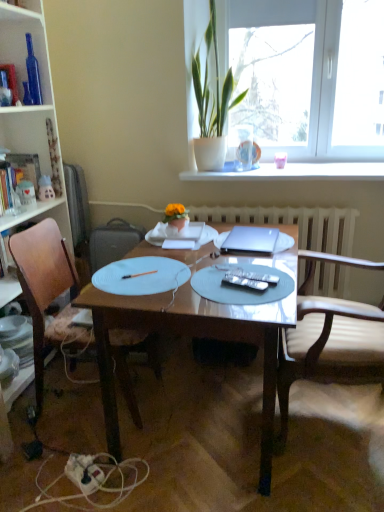
This screenshot has height=512, width=384. I want to click on blank space above matte blue paper plate at center, placed as the first paper plate when sorted from right to left (from a real-world perspective), so click(x=239, y=280).